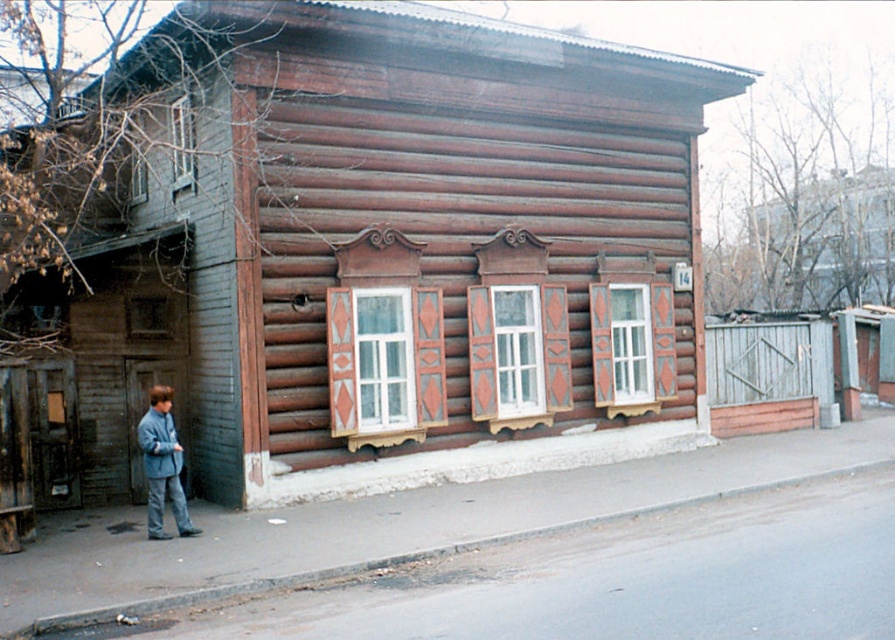
Question: Which of the following is the closest to the observer?

Choices:
 (A) gray concrete curb at lower center
 (B) brown wooden hut at center
 (C) light blue fabric jacket at lower left

Answer: (A)

Question: Considering the real-world distances, which object is farthest from the wooden fence at upper right?

Choices:
 (A) brown wooden hut at center
 (B) gray concrete curb at lower center

Answer: (A)

Question: Which of these objects is positioned farthest from the light blue fabric jacket at lower left?

Choices:
 (A) wooden fence at upper right
 (B) brown wooden hut at center
 (C) gray concrete curb at lower center

Answer: (A)

Question: Is wooden fence at upper right bigger than gray concrete curb at lower center?

Choices:
 (A) yes
 (B) no

Answer: (B)

Question: Is gray concrete curb at lower center wider than light blue fabric jacket at lower left?

Choices:
 (A) no
 (B) yes

Answer: (B)

Question: Considering the relative positions of wooden fence at upper right and light blue fabric jacket at lower left in the image provided, where is wooden fence at upper right located with respect to light blue fabric jacket at lower left?

Choices:
 (A) right
 (B) left

Answer: (A)